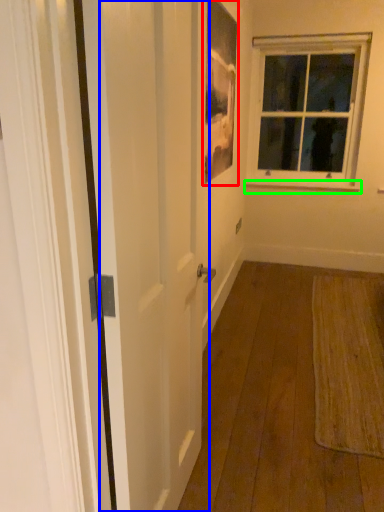
Question: Considering the real-world distances, which object is closest to picture frame (highlighted by a red box)? screen door (highlighted by a blue box) or window sill (highlighted by a green box).

Choices:
 (A) screen door
 (B) window sill

Answer: (A)